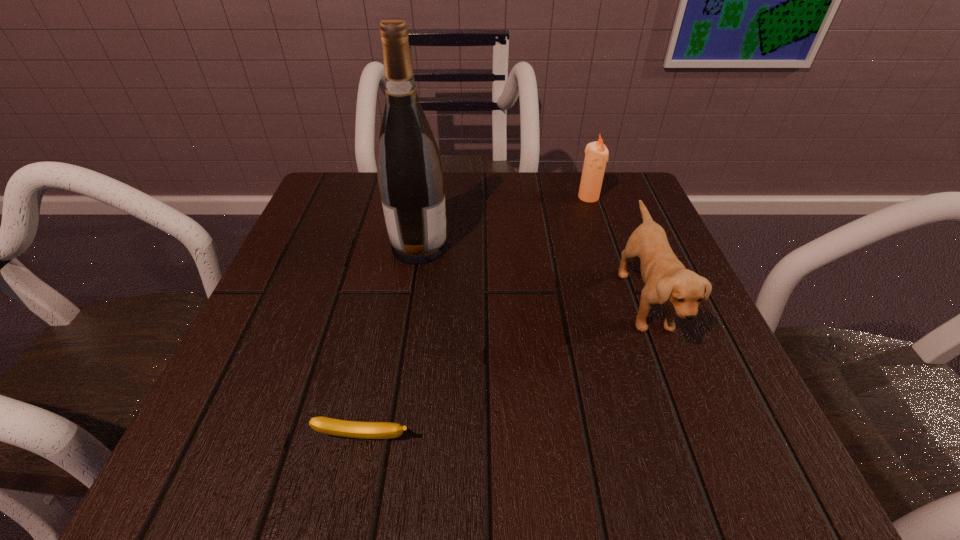
Find the location of a particular element. wine bottle that is at the far edge is located at coordinates click(x=410, y=174).

I want to click on candle located at the far edge, so click(x=596, y=153).

Find the location of a particular element. object that is at the near edge is located at coordinates click(x=353, y=429).

Image resolution: width=960 pixels, height=540 pixels. What are the coordinates of `object that is at the left edge` in the screenshot? It's located at (353, 429).

Find the location of `candle positioned at the right edge`. candle positioned at the right edge is located at coordinates (596, 153).

This screenshot has width=960, height=540. In order to click on puppy at the right edge in this screenshot , I will do `click(667, 282)`.

Find the location of a particular element. This screenshot has width=960, height=540. object located in the near left corner section of the desktop is located at coordinates (353, 429).

Where is `object that is at the far right corner`? object that is at the far right corner is located at coordinates (596, 153).

In order to click on free space at the far edge of the desktop in this screenshot , I will do `click(469, 226)`.

You are a GUI agent. You are given a task and a screenshot of the screen. Output one action in this format:
    pyautogui.click(x=<x>, y=<y>)
    Task: Click on the vacant space at the near edge of the desktop
    This screenshot has height=540, width=960.
    Given the screenshot: What is the action you would take?
    pyautogui.click(x=397, y=469)